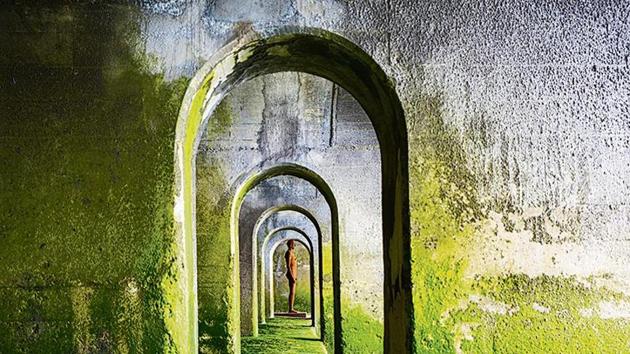
This screenshot has width=630, height=354. What are the coordinates of `green on walls` in the screenshot? It's located at (132, 244), (477, 321).